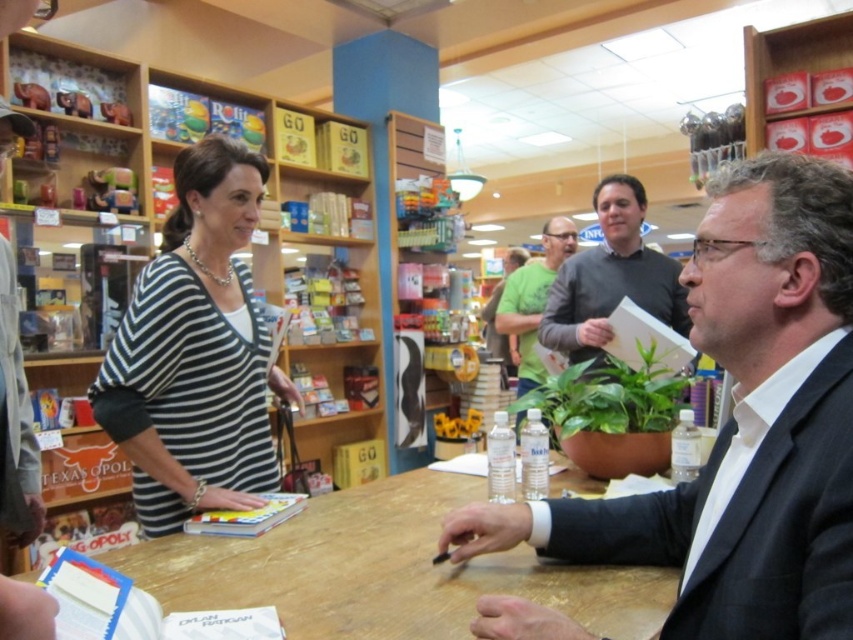
Can you confirm if green t-shirt at center is smaller than green cotton shirt at center?

Incorrect, green t-shirt at center is not smaller in size than green cotton shirt at center.

Who is lower down, green t-shirt at center or green cotton shirt at center?

Positioned lower is green cotton shirt at center.

Who is more distant from viewer, (543, 227) or (500, 355)?

Positioned behind is point (543, 227).

This screenshot has width=853, height=640. Identify the location of green t-shirt at center. (532, 300).

Does wooden shelves at upper left appear on the right side of wooden table at center?

No, wooden shelves at upper left is not to the right of wooden table at center.

Can you confirm if wooden shelves at upper left is positioned above wooden table at center?

Yes, wooden shelves at upper left is above wooden table at center.

Is point (228, 394) positioned in front of point (556, 486)?

Yes, it is.

This screenshot has width=853, height=640. Find the location of `wooden shelves at upper left`. wooden shelves at upper left is located at coordinates (219, 339).

Is gray sweater at center shorter than green cotton shirt at center?

Incorrect, gray sweater at center's height does not fall short of green cotton shirt at center's.

Is gray sweater at center positioned behind green cotton shirt at center?

No.

Locate an element on the screen. gray sweater at center is located at coordinates (611, 276).